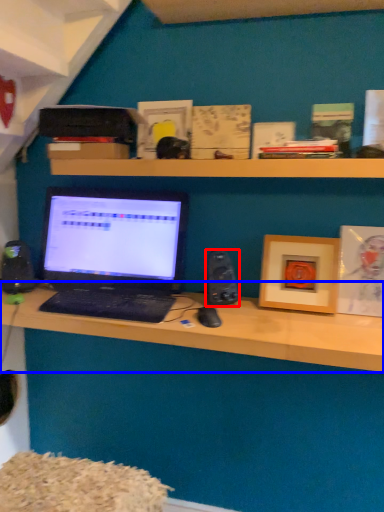
Question: Which of the following is the farthest to the observer, speaker (highlighted by a red box) or desk (highlighted by a blue box)?

Choices:
 (A) speaker
 (B) desk

Answer: (A)